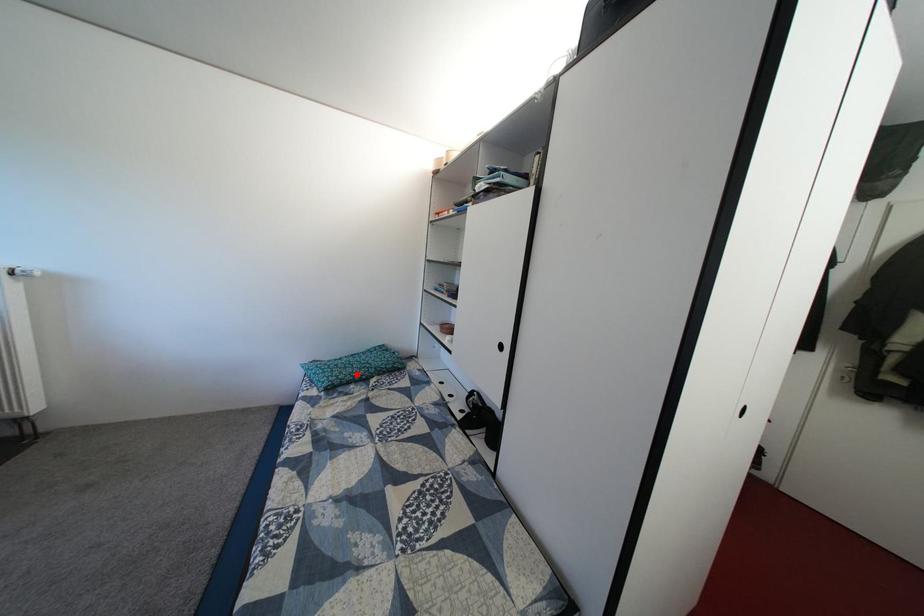
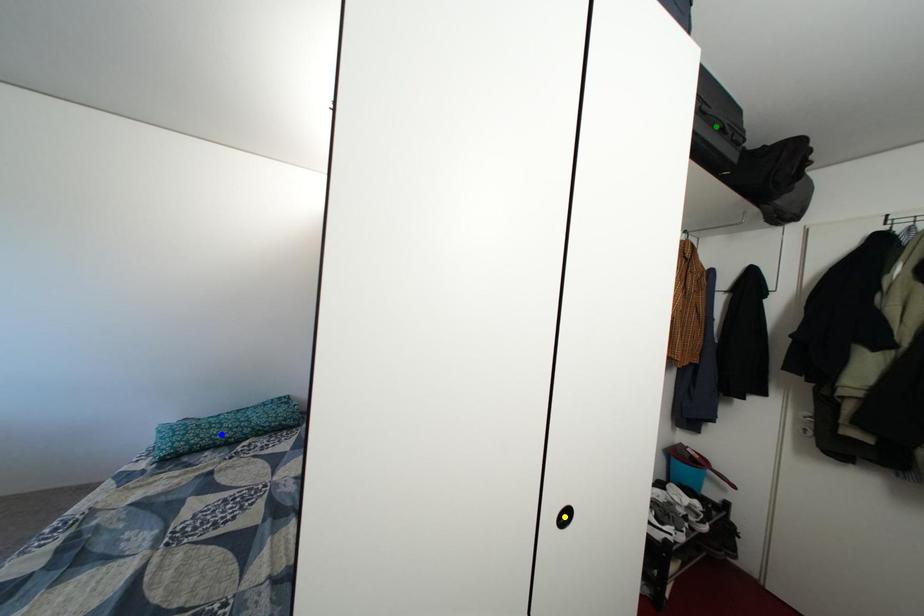
Question: I am providing you with two images of the same scene from different viewpoints. A red point is marked on the first image. You are given multiple points on the second image. In image 2, which mark is for the same physical point as the one in image 1?

Choices:
 (A) yellow point
 (B) green point
 (C) blue point

Answer: (C)